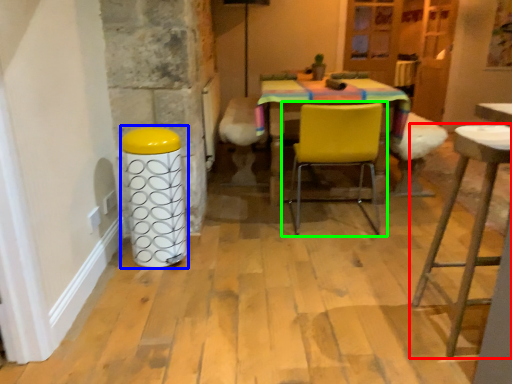
Question: Based on their relative distances, which object is farther from stool (highlighted by a red box)? Choose from bar stool (highlighted by a blue box) and chair (highlighted by a green box).

Choices:
 (A) bar stool
 (B) chair

Answer: (A)